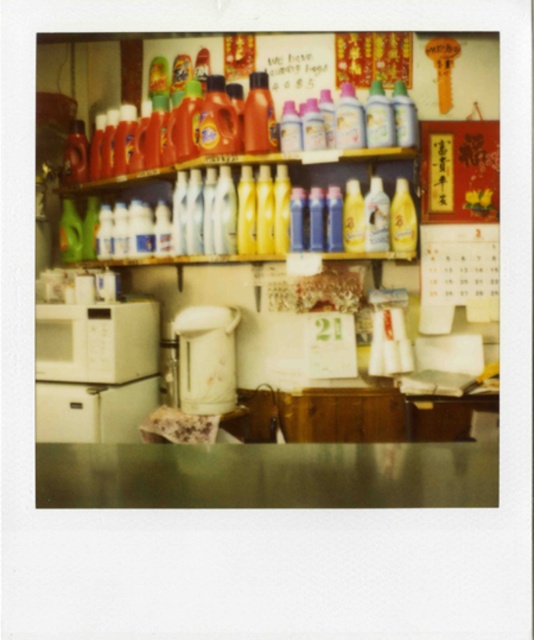
Question: Based on their relative distances, which object is nearer to the metallic reflective counter top at lower center?

Choices:
 (A) translucent plastic bottles at upper center
 (B) white glossy electric kettle at center
 (C) matte plastic bottles at upper center
 (D) white matte microwave at lower left

Answer: (D)

Question: From the image, what is the correct spatial relationship of metallic reflective counter top at lower center in relation to white matte microwave at lower left?

Choices:
 (A) below
 (B) above

Answer: (A)

Question: Observing the image, what is the correct spatial positioning of white matte microwave at lower left in reference to translucent plastic bottles at upper center?

Choices:
 (A) above
 (B) below

Answer: (B)

Question: Which object is farther from the camera taking this photo?

Choices:
 (A) metallic reflective counter top at lower center
 (B) matte plastic bottles at upper center
 (C) white matte microwave at lower left
 (D) translucent plastic bottles at upper center

Answer: (C)

Question: Is matte plastic bottles at upper center below white glossy electric kettle at center?

Choices:
 (A) yes
 (B) no

Answer: (B)

Question: Which point appears closest to the camera in this image?

Choices:
 (A) (215, 394)
 (B) (37, 378)
 (C) (183, 464)
 (D) (62, 236)

Answer: (C)